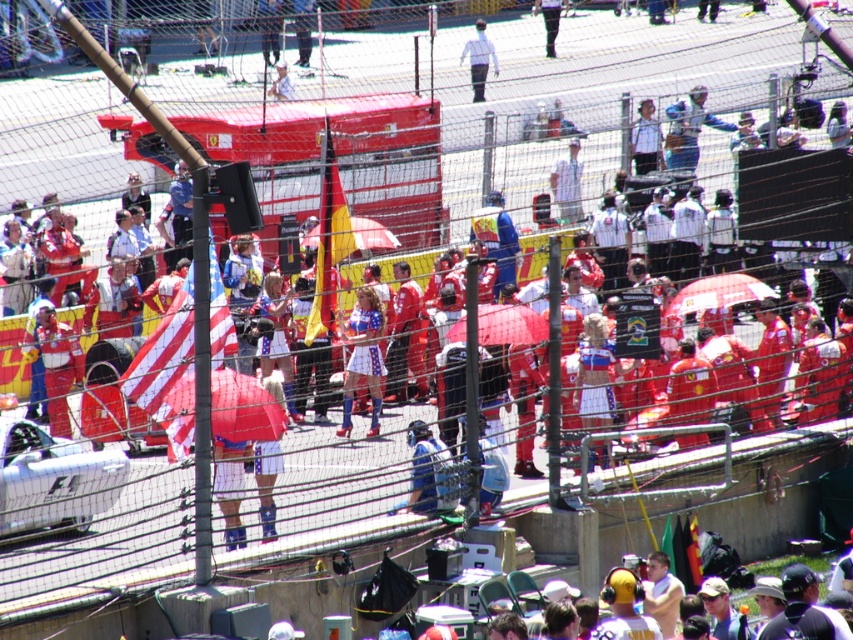
From the picture: You are a photographer trying to capture both the red matte bus at center and the red fabric umbrella at center in the same frame. Which object should you focus on first to ensure both are in the frame?

The red matte bus at center is bigger than the red fabric umbrella at center, so you should focus on the red matte bus at center first to ensure both fit in the frame.

You are a photographer at the motorsport event. You need to capture a photo where both the matte red dress at center and the red fabric umbrella at center are visible. Given their sizes, which object should you focus on to ensure both are in frame without zooming in too much?

The matte red dress at center is taller than the red fabric umbrella at center. To ensure both are in frame without zooming in too much, focus on the taller object, which is the matte red dress at center, as it will require a wider angle to include both.

You are a photographer at the motorsport event and want to capture both the matte red dress at center and the white fabric umbrella at center in a single frame. Which object should you focus on first to ensure both are in the frame?

Since the matte red dress at center is larger than the white fabric umbrella at center, you should focus on the matte red dress at center first to ensure both objects fit within the frame.